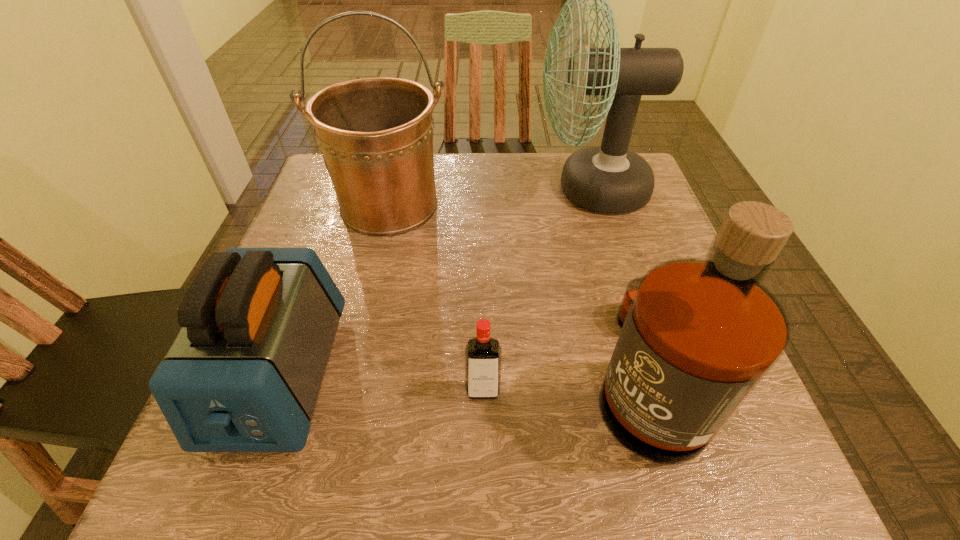
Locate an element on the screen. vacant position located on the front label of the liquor is located at coordinates (507, 374).

Where is `blank area located on the front label of the liquor`? This screenshot has height=540, width=960. blank area located on the front label of the liquor is located at coordinates (464, 374).

Identify the location of free space located 0.290m on the front label of the liquor. The width and height of the screenshot is (960, 540). (415, 374).

Identify the location of free point located on the front and back of the shortest object. The image size is (960, 540). (483, 446).

You are a GUI agent. You are given a task and a screenshot of the screen. Output one action in this format:
    pyautogui.click(x=<x>, y=<y>)
    Task: Click on the fan that is at the far edge
    Image resolution: width=960 pixels, height=540 pixels.
    Given the screenshot: What is the action you would take?
    pyautogui.click(x=609, y=178)

Image resolution: width=960 pixels, height=540 pixels. What are the coordinates of `bucket located in the far edge section of the desktop` in the screenshot? It's located at (375, 134).

Where is `liquor present at the near edge`? This screenshot has width=960, height=540. liquor present at the near edge is located at coordinates (698, 335).

Where is `toaster that is at the near edge`? Image resolution: width=960 pixels, height=540 pixels. toaster that is at the near edge is located at coordinates (244, 373).

Identify the location of bucket that is at the left edge. The image size is (960, 540). (375, 134).

The height and width of the screenshot is (540, 960). I want to click on toaster that is at the left edge, so click(244, 373).